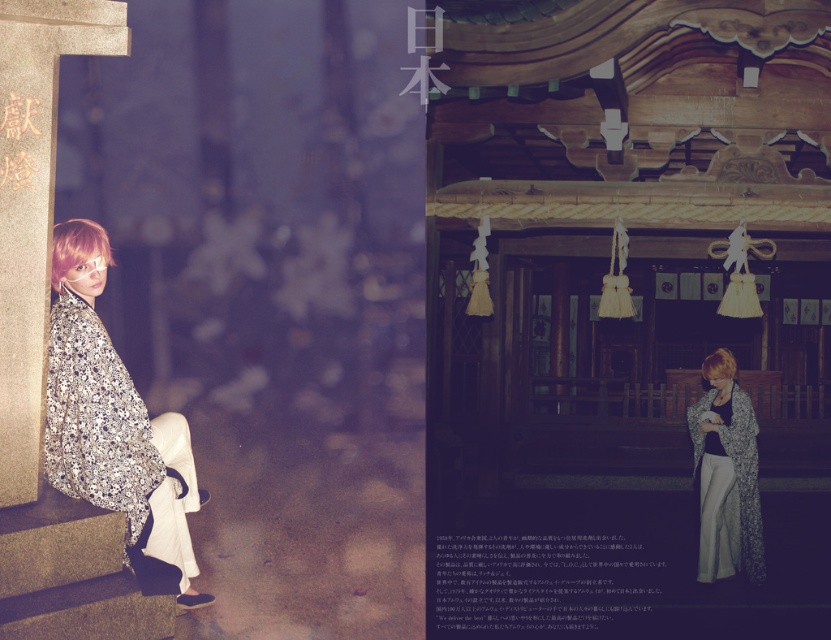
Is point (61, 285) positioned in front of point (554, 582)?

That is True.

Where is `silver metallic kimono at left`? This screenshot has width=831, height=640. silver metallic kimono at left is located at coordinates (114, 426).

Is the position of silver metallic kimono at left less distant than that of floral kimono at center?

Yes, silver metallic kimono at left is in front of floral kimono at center.

Does silver metallic kimono at left appear on the left side of floral kimono at center?

Yes, silver metallic kimono at left is to the left of floral kimono at center.

Is point (47, 416) less distant than point (699, 500)?

Yes.

Locate an element on the screen. silver metallic kimono at left is located at coordinates (114, 426).

Is the position of black paper at lower center less distant than that of floral kimono at center?

Yes.

Which of these two, black paper at lower center or floral kimono at center, stands taller?

floral kimono at center

Is point (505, 625) closer to camera compared to point (711, 433)?

Yes.

Image resolution: width=831 pixels, height=640 pixels. I want to click on black paper at lower center, so click(539, 580).